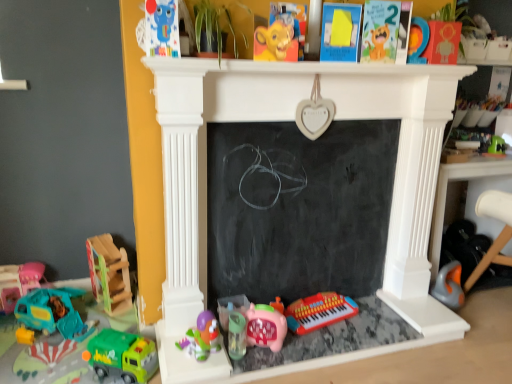
What do you see at coordinates (443, 42) in the screenshot?
I see `matte orange wooden number at upper right, marked as the eleventh toy in a left-to-right arrangement` at bounding box center [443, 42].

The height and width of the screenshot is (384, 512). What do you see at coordinates (319, 311) in the screenshot?
I see `plastic red keyboard at lower center, which ranks as the 4th toy in right-to-left order` at bounding box center [319, 311].

Image resolution: width=512 pixels, height=384 pixels. What do you see at coordinates (122, 356) in the screenshot? I see `green plastic toy truck at lower left, which is the ninth toy from right to left` at bounding box center [122, 356].

What is the approximate width of teal plastic toy car at lower left, the second toy from the left?

The width of teal plastic toy car at lower left, the second toy from the left, is 10.17 inches.

What is the approximate height of teal plastic toy car at left, arranged as the 12th toy when viewed from the right?

teal plastic toy car at left, arranged as the 12th toy when viewed from the right, is 23.40 centimeters in height.

Image resolution: width=512 pixels, height=384 pixels. What do you see at coordinates (18, 283) in the screenshot?
I see `teal plastic toy car at left, placed as the 1th toy when sorted from left to right` at bounding box center [18, 283].

This screenshot has width=512, height=384. What do you see at coordinates (449, 286) in the screenshot? I see `orange plastic vacuum cleaner at lower right, the 1th toy viewed from the right` at bounding box center [449, 286].

Describe the element at coordinates (236, 335) in the screenshot. I see `translucent plastic sippy cup at lower center, which is the seventh toy from left to right` at that location.

Locate an element on the screen. Image resolution: width=512 pixels, height=384 pixels. pink matte piggy bank at center, the eighth toy in the left-to-right sequence is located at coordinates (266, 326).

Where is `matte orange wooden number at upper right, marked as the eleventh toy in a left-to-right arrangement`? matte orange wooden number at upper right, marked as the eleventh toy in a left-to-right arrangement is located at coordinates (443, 42).

Is teal plastic toy car at lower left, the second toy from the left, beside translucent plastic sippy cup at lower center, which is the seventh toy from left to right?

teal plastic toy car at lower left, the second toy from the left, and translucent plastic sippy cup at lower center, which is the seventh toy from left to right, are not in contact.

Which object is positioned more to the right, teal plastic toy car at lower left, the second toy from the left, or translucent plastic sippy cup at lower center, which is the seventh toy from left to right?

translucent plastic sippy cup at lower center, which is the seventh toy from left to right, is more to the right.

Which object is thinner, teal plastic toy car at lower left, placed as the 11th toy when sorted from right to left, or translucent plastic sippy cup at lower center, the sixth toy from the right?

Thinner between the two is translucent plastic sippy cup at lower center, the sixth toy from the right.

Image resolution: width=512 pixels, height=384 pixels. I want to click on the 2nd toy in front of the orange plastic vacuum cleaner at lower right, the twelfth toy when ordered from left to right, so click(109, 274).

Can you tell me how much wooden rocking horse at left, the third toy from the left, and orange plastic vacuum cleaner at lower right, the twelfth toy when ordered from left to right, differ in facing direction?

The angular difference between wooden rocking horse at left, the third toy from the left, and orange plastic vacuum cleaner at lower right, the twelfth toy when ordered from left to right, is 8.66 degrees.

Is orange plastic vacuum cleaner at lower right, the 1th toy viewed from the right, located within wooden rocking horse at left, the third toy from the left?

That's incorrect, orange plastic vacuum cleaner at lower right, the 1th toy viewed from the right, is not inside wooden rocking horse at left, the third toy from the left.

Looking at this image, visually, is wooden rocking horse at left, the third toy from the left, positioned to the left or to the right of orange plastic vacuum cleaner at lower right, the twelfth toy when ordered from left to right?

wooden rocking horse at left, the third toy from the left, is positioned on orange plastic vacuum cleaner at lower right, the twelfth toy when ordered from left to right,'s left side.

Is teal plastic toy car at left, placed as the 1th toy when sorted from left to right, in front of or behind orange plastic vacuum cleaner at lower right, the twelfth toy when ordered from left to right, in the image?

teal plastic toy car at left, placed as the 1th toy when sorted from left to right, is in front of orange plastic vacuum cleaner at lower right, the twelfth toy when ordered from left to right.

Is teal plastic toy car at left, arranged as the 12th toy when viewed from the right, surrounding orange plastic vacuum cleaner at lower right, the twelfth toy when ordered from left to right?

Definitely not — orange plastic vacuum cleaner at lower right, the twelfth toy when ordered from left to right, is not inside teal plastic toy car at left, arranged as the 12th toy when viewed from the right.

Is teal plastic toy car at left, arranged as the 12th toy when viewed from the right, taller than orange plastic vacuum cleaner at lower right, the twelfth toy when ordered from left to right?

No.

How much distance is there between teal plastic toy car at left, placed as the 1th toy when sorted from left to right, and orange plastic vacuum cleaner at lower right, the twelfth toy when ordered from left to right?

1.99 meters.

Visually, is plastic toy at lower left, the 7th toy when ordered from right to left, positioned to the left or to the right of pink matte piggy bank at center, the eighth toy in the left-to-right sequence?

plastic toy at lower left, the 7th toy when ordered from right to left, is positioned on pink matte piggy bank at center, the eighth toy in the left-to-right sequence,'s left side.

Is point (214, 329) positioned behind point (271, 337)?

No, it is not.

From the image's perspective, which one is positioned higher, plastic toy at lower left, the 7th toy when ordered from right to left, or pink matte piggy bank at center, which is the fifth toy in right-to-left order?

plastic toy at lower left, the 7th toy when ordered from right to left, appears higher in the image.

Is plastic toy at lower left, the 7th toy when ordered from right to left, with pink matte piggy bank at center, the eighth toy in the left-to-right sequence?

There is a gap between plastic toy at lower left, the 7th toy when ordered from right to left, and pink matte piggy bank at center, the eighth toy in the left-to-right sequence.

Is plastic toy at lower left, the 7th toy when ordered from right to left, behind teal plastic toy car at left, arranged as the 12th toy when viewed from the right?

No.

From the image's perspective, is plastic toy at lower left, the 6th toy from the left, located beneath teal plastic toy car at left, placed as the 1th toy when sorted from left to right?

Yes, from the image's perspective, plastic toy at lower left, the 6th toy from the left, is below teal plastic toy car at left, placed as the 1th toy when sorted from left to right.

Can you see plastic toy at lower left, the 7th toy when ordered from right to left, touching teal plastic toy car at left, arranged as the 12th toy when viewed from the right?

No, plastic toy at lower left, the 7th toy when ordered from right to left, is not making contact with teal plastic toy car at left, arranged as the 12th toy when viewed from the right.

Consider the image. Is wooden rocking horse at left, the tenth toy in the right-to-left sequence, wider than black chalkboard at center?

Correct, the width of wooden rocking horse at left, the tenth toy in the right-to-left sequence, exceeds that of black chalkboard at center.

From the image's perspective, which is above, wooden rocking horse at left, the tenth toy in the right-to-left sequence, or black chalkboard at center?

black chalkboard at center.

Is wooden rocking horse at left, the third toy from the left, shorter than black chalkboard at center?

Indeed, wooden rocking horse at left, the third toy from the left, has a lesser height compared to black chalkboard at center.

Can you tell me how much wooden rocking horse at left, the tenth toy in the right-to-left sequence, and black chalkboard at center differ in facing direction?

The angular difference between wooden rocking horse at left, the tenth toy in the right-to-left sequence, and black chalkboard at center is 19.5 degrees.

Considering the positions of objects orange plastic vacuum cleaner at lower right, the 1th toy viewed from the right, and wooden rocking horse at left, the tenth toy in the right-to-left sequence, in the image provided, who is more to the left, orange plastic vacuum cleaner at lower right, the 1th toy viewed from the right, or wooden rocking horse at left, the tenth toy in the right-to-left sequence,?

wooden rocking horse at left, the tenth toy in the right-to-left sequence, is more to the left.

Which is correct: orange plastic vacuum cleaner at lower right, the 1th toy viewed from the right, is inside wooden rocking horse at left, the third toy from the left, or outside of it?

orange plastic vacuum cleaner at lower right, the 1th toy viewed from the right, is not inside wooden rocking horse at left, the third toy from the left, it's outside.

Can you confirm if orange plastic vacuum cleaner at lower right, the 1th toy viewed from the right, is shorter than wooden rocking horse at left, the third toy from the left?

Correct, orange plastic vacuum cleaner at lower right, the 1th toy viewed from the right, is not as tall as wooden rocking horse at left, the third toy from the left.

Measure the distance from orange plastic vacuum cleaner at lower right, the twelfth toy when ordered from left to right, to wooden rocking horse at left, the third toy from the left.

orange plastic vacuum cleaner at lower right, the twelfth toy when ordered from left to right, is 1.59 meters away from wooden rocking horse at left, the third toy from the left.

Locate an element on the screen. the 4th toy in front of the teal plastic toy car at lower left, the second toy from the left is located at coordinates (236, 335).

You are a GUI agent. You are given a task and a screenshot of the screen. Output one action in this format:
    pyautogui.click(x=<x>, y=<y>)
    Task: Click on the 2nd toy above when counting from the orange plastic vacuum cleaner at lower right, the 1th toy viewed from the right (from the image's perspective)
    The height and width of the screenshot is (384, 512).
    Given the screenshot: What is the action you would take?
    pyautogui.click(x=109, y=274)

From the image, which object appears to be farther from matte plastic toy at upper left, arranged as the fifth toy when viewed from the left, plastic toy at lower left, the 7th toy when ordered from right to left, or green plastic toy truck at lower left, marked as the 4th toy in a left-to-right arrangement?

Based on the image, green plastic toy truck at lower left, marked as the 4th toy in a left-to-right arrangement, appears to be further to matte plastic toy at upper left, arranged as the fifth toy when viewed from the left.

Which object lies further to the anchor point orange plastic letter q at upper center, which is the 3th toy in right-to-left order, wooden rocking horse at left, the third toy from the left, or matte plastic toy at upper left, which appears as the eighth toy when viewed from the right?

wooden rocking horse at left, the third toy from the left.

Based on their spatial positions, is wooden chair at right or plastic red keyboard at lower center, which ranks as the 4th toy in right-to-left order, closer to yellow matte lion head at upper center?

plastic red keyboard at lower center, which ranks as the 4th toy in right-to-left order, lies closer to yellow matte lion head at upper center than the other object.

When comparing their distances from orange plastic letter q at upper center, the tenth toy from the left, does pink matte piggy bank at center, which is the fifth toy in right-to-left order, or wooden rocking horse at left, the third toy from the left, seem further?

The object further to orange plastic letter q at upper center, the tenth toy from the left, is wooden rocking horse at left, the third toy from the left.

Based on their spatial positions, is orange plastic vacuum cleaner at lower right, the twelfth toy when ordered from left to right, or orange plastic letter q at upper center, which is the 3th toy in right-to-left order, closer to teal plastic toy car at lower left, placed as the 11th toy when sorted from right to left?

orange plastic vacuum cleaner at lower right, the twelfth toy when ordered from left to right, is closer to teal plastic toy car at lower left, placed as the 11th toy when sorted from right to left.

Estimate the real-world distances between objects in this image. Which object is further from pink matte piggy bank at center, which is the fifth toy in right-to-left order, orange plastic letter q at upper center, which is the 3th toy in right-to-left order, or green plastic toy truck at lower left, marked as the 4th toy in a left-to-right arrangement?

orange plastic letter q at upper center, which is the 3th toy in right-to-left order, lies further to pink matte piggy bank at center, which is the fifth toy in right-to-left order, than the other object.

Looking at the image, which one is located closer to wooden rocking horse at left, the tenth toy in the right-to-left sequence, plastic toy at lower left, the 7th toy when ordered from right to left, or matte plastic toy at upper left, arranged as the fifth toy when viewed from the left?

Based on the image, plastic toy at lower left, the 7th toy when ordered from right to left, appears to be nearer to wooden rocking horse at left, the tenth toy in the right-to-left sequence.

Based on their spatial positions, is orange plastic vacuum cleaner at lower right, the 1th toy viewed from the right, or wooden chair at right closer to yellow matte lion head at upper center?

wooden chair at right lies closer to yellow matte lion head at upper center than the other object.

Image resolution: width=512 pixels, height=384 pixels. What are the coordinates of `book between orange plastic letter q at upper center, which is the 3th toy in right-to-left order, and plastic toy at lower left, the 6th toy from the left, from top to bottom` in the screenshot? It's located at (291, 21).

This screenshot has width=512, height=384. I want to click on book between teal plastic toy car at lower left, the second toy from the left, and wooden chair at right from left to right, so click(x=291, y=21).

This screenshot has height=384, width=512. Find the location of `toy between teal plastic toy car at left, arranged as the 12th toy when viewed from the right, and wooden rocking horse at left, the tenth toy in the right-to-left sequence, in the horizontal direction`. toy between teal plastic toy car at left, arranged as the 12th toy when viewed from the right, and wooden rocking horse at left, the tenth toy in the right-to-left sequence, in the horizontal direction is located at coordinates (53, 312).

I want to click on toy between yellow matte lion head at upper center and wooden rocking horse at left, the third toy from the left, from top to bottom, so click(162, 28).